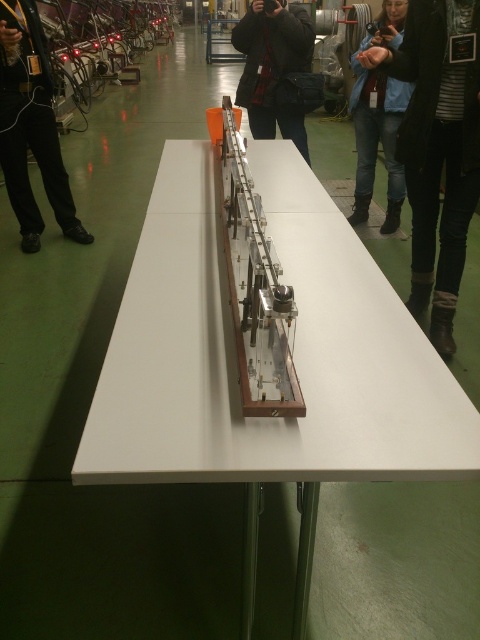
You are a photographer at the industrial event and you need to capture a photo of the transparent box with the mechanical apparatus. You see the black leather pants at left and the black leather jacket at center. Which clothing item is more to the left?

The black leather pants at left is more to the left than the black leather jacket at center.

You are standing in a laboratory and see the white glossy table at center and the black leather pants at left. Which object is closer to the floor?

The white glossy table at center is closer to the floor because it is located below the black leather pants at left.